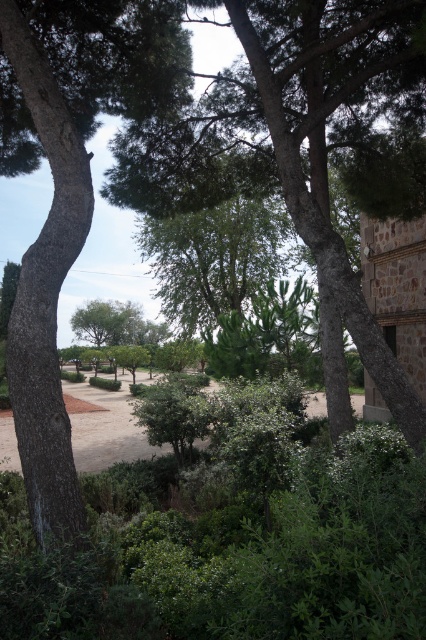
Locate an element on the screen. This screenshot has height=640, width=426. green leafy tree at center is located at coordinates (293, 138).

Find the location of a particular element. Image resolution: width=426 pixels, height=640 pixels. green rough bark tree at left is located at coordinates (68, 192).

Is green rough bark tree at left thinner than brown dirt field at center?

Yes.

Does point (23, 440) come farther from viewer compared to point (150, 454)?

No, it is not.

Find the location of a particular element. green rough bark tree at left is located at coordinates (68, 192).

Between green leafy tree at center and brown dirt field at center, which one has more height?

brown dirt field at center

Can you confirm if green leafy tree at center is bigger than brown dirt field at center?

Incorrect, green leafy tree at center is not larger than brown dirt field at center.

At what (x,y) coordinates should I click in order to perform the action: click on green leafy tree at center. Please return your answer as a coordinate pair (x, y). The width and height of the screenshot is (426, 640). Looking at the image, I should click on (293, 138).